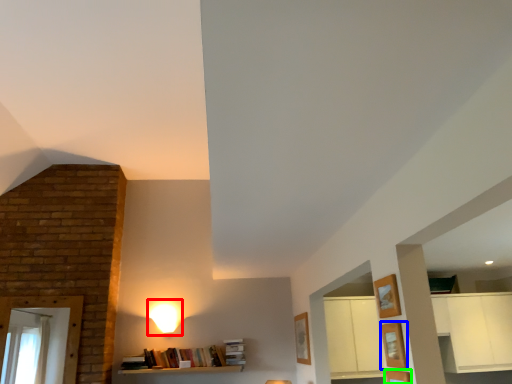
Question: Considering the real-world distances, which object is farthest from lamp (highlighted by a red box)? shelf (highlighted by a blue box) or shelf (highlighted by a green box)?

Choices:
 (A) shelf
 (B) shelf

Answer: (A)